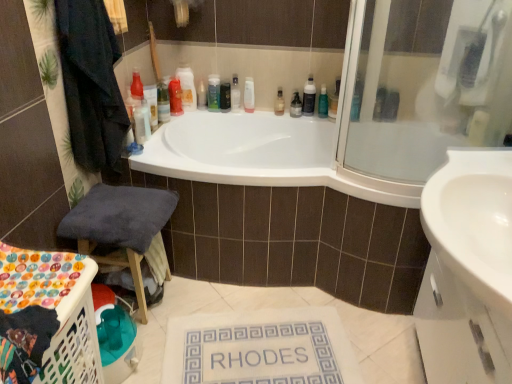
Question: Should I look upward or downward to see matte plastic bottle at upper center, which is the tenth toiletry from left to right?

Choices:
 (A) up
 (B) down

Answer: (A)

Question: From the image's perspective, is matte plastic container at upper center, the ninth toiletry when ordered from right to left, above white fabric bath mat at center?

Choices:
 (A) yes
 (B) no

Answer: (A)

Question: Considering the relative positions of matte plastic container at upper center, the ninth toiletry when ordered from right to left, and white fabric bath mat at center in the image provided, is matte plastic container at upper center, the ninth toiletry when ordered from right to left, in front of white fabric bath mat at center?

Choices:
 (A) no
 (B) yes

Answer: (A)

Question: Is matte plastic container at upper center, the ninth toiletry when ordered from right to left, shorter than white fabric bath mat at center?

Choices:
 (A) no
 (B) yes

Answer: (A)

Question: From a real-world perspective, is matte plastic container at upper center, the second toiletry when ordered from left to right, located higher than white fabric bath mat at center?

Choices:
 (A) no
 (B) yes

Answer: (B)

Question: Considering the relative sizes of matte plastic container at upper center, the second toiletry when ordered from left to right, and white fabric bath mat at center in the image provided, is matte plastic container at upper center, the second toiletry when ordered from left to right, smaller than white fabric bath mat at center?

Choices:
 (A) yes
 (B) no

Answer: (A)

Question: From the image's perspective, would you say matte plastic container at upper center, the second toiletry when ordered from left to right, is shown under white fabric bath mat at center?

Choices:
 (A) no
 (B) yes

Answer: (A)

Question: Is translucent plastic bottle at upper center, acting as the first toiletry starting from the left, to the left of dark blue fabric stool at lower left from the viewer's perspective?

Choices:
 (A) yes
 (B) no

Answer: (B)

Question: Considering the relative positions of translucent plastic bottle at upper center, acting as the first toiletry starting from the left, and dark blue fabric stool at lower left in the image provided, is translucent plastic bottle at upper center, acting as the first toiletry starting from the left, behind dark blue fabric stool at lower left?

Choices:
 (A) yes
 (B) no

Answer: (A)

Question: Considering the relative sizes of translucent plastic bottle at upper center, acting as the first toiletry starting from the left, and dark blue fabric stool at lower left in the image provided, is translucent plastic bottle at upper center, acting as the first toiletry starting from the left, taller than dark blue fabric stool at lower left?

Choices:
 (A) no
 (B) yes

Answer: (A)

Question: Would you consider translucent plastic bottle at upper center, acting as the first toiletry starting from the left, to be distant from dark blue fabric stool at lower left?

Choices:
 (A) no
 (B) yes

Answer: (A)

Question: Is translucent plastic bottle at upper center, which is the tenth toiletry in right-to-left order, touching dark blue fabric stool at lower left?

Choices:
 (A) yes
 (B) no

Answer: (B)

Question: From a real-world perspective, is translucent plastic bottle at upper center, acting as the first toiletry starting from the left, physically above dark blue fabric stool at lower left?

Choices:
 (A) yes
 (B) no

Answer: (A)

Question: Considering the relative sizes of translucent plastic bottle at upper center, acting as the first toiletry starting from the left, and white plastic laundry basket at lower left in the image provided, is translucent plastic bottle at upper center, acting as the first toiletry starting from the left, wider than white plastic laundry basket at lower left?

Choices:
 (A) no
 (B) yes

Answer: (A)